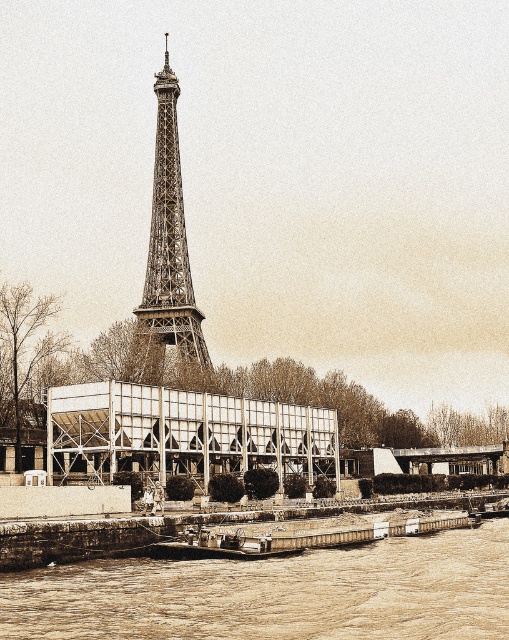
You are standing on the bank of the Seine River and see the brown sedimentary river at lower center and the rustic wood boat at lower center. Which object is closer to the water surface?

The rustic wood boat at lower center is closer to the water surface because the brown sedimentary river at lower center is located below it.

You are standing at the point closest to the camera in the image. Which point, point (19, 634) or point (303, 541), are you standing on?

You are standing on point (19, 634) because it is in front of point (303, 541), meaning it is closer to the camera.

You are a photographer standing at the edge of the brown sedimentary river at lower center, aiming to capture the Eiffel Tower in the background. Given that your camera has a maximum focusing range of 60 meters, will you be able to focus on the Eiffel Tower?

The distance of brown sedimentary river at lower center from camera is 59.15 meters, which is within the camera maximum focusing range of 60 meters. Therefore, you can focus on the Eiffel Tower.